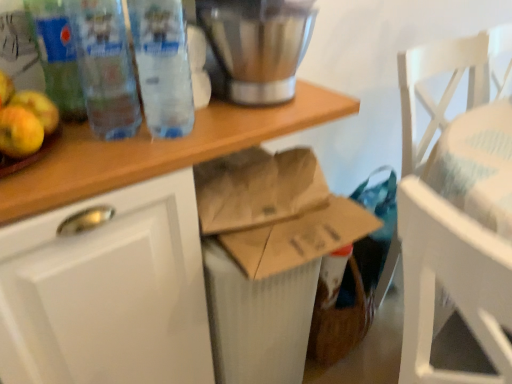
Identify the location of vacant region to the right of transparent plastic bottles at upper left, arranged as the 1th bottle when viewed from the right. Image resolution: width=512 pixels, height=384 pixels. (247, 122).